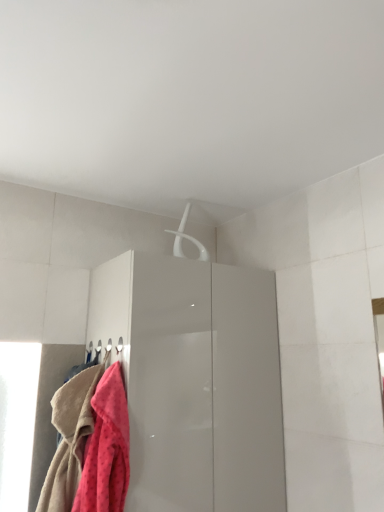
Question: Is fluffy pink towel at lower left, which appears as the 2th towel when viewed from the left, thinner than glossy white cabinet at center?

Choices:
 (A) yes
 (B) no

Answer: (A)

Question: Can you confirm if fluffy pink towel at lower left, which appears as the 2th towel when viewed from the left, is positioned to the right of glossy white cabinet at center?

Choices:
 (A) yes
 (B) no

Answer: (B)

Question: From a real-world perspective, does fluffy pink towel at lower left, which appears as the 2th towel when viewed from the left, stand above glossy white cabinet at center?

Choices:
 (A) yes
 (B) no

Answer: (B)

Question: Can you confirm if fluffy pink towel at lower left, the first towel from the right, is taller than glossy white cabinet at center?

Choices:
 (A) yes
 (B) no

Answer: (B)

Question: Considering the positions of fluffy pink towel at lower left, the first towel from the right, and fluffy pink towel at lower left, arranged as the 1th towel when viewed from the left, in the image, is fluffy pink towel at lower left, the first towel from the right, bigger or smaller than fluffy pink towel at lower left, arranged as the 1th towel when viewed from the left,?

Choices:
 (A) big
 (B) small

Answer: (B)

Question: Which is correct: fluffy pink towel at lower left, the first towel from the right, is inside fluffy pink towel at lower left, arranged as the 1th towel when viewed from the left, or outside of it?

Choices:
 (A) outside
 (B) inside

Answer: (A)

Question: In the image, is fluffy pink towel at lower left, which appears as the 2th towel when viewed from the left, positioned in front of or behind fluffy pink towel at lower left, arranged as the 1th towel when viewed from the left?

Choices:
 (A) front
 (B) behind

Answer: (A)

Question: Is fluffy pink towel at lower left, which appears as the 2th towel when viewed from the left, wider or thinner than fluffy pink towel at lower left, arranged as the 1th towel when viewed from the left?

Choices:
 (A) wide
 (B) thin

Answer: (B)

Question: In terms of width, does glossy white cabinet at center look wider or thinner when compared to fluffy pink towel at lower left, which appears as the 2th towel when viewed from the left?

Choices:
 (A) thin
 (B) wide

Answer: (B)

Question: Is glossy white cabinet at center taller or shorter than fluffy pink towel at lower left, which appears as the 2th towel when viewed from the left?

Choices:
 (A) short
 (B) tall

Answer: (B)

Question: Based on their positions, is glossy white cabinet at center located to the left or right of fluffy pink towel at lower left, which appears as the 2th towel when viewed from the left?

Choices:
 (A) right
 (B) left

Answer: (A)

Question: Do you think glossy white cabinet at center is within fluffy pink towel at lower left, which appears as the 2th towel when viewed from the left, or outside of it?

Choices:
 (A) inside
 (B) outside

Answer: (B)

Question: Relative to fluffy pink towel at lower left, the first towel from the right, is white plastic hanger at upper center in front or behind?

Choices:
 (A) front
 (B) behind

Answer: (B)

Question: In terms of size, does white plastic hanger at upper center appear bigger or smaller than fluffy pink towel at lower left, which appears as the 2th towel when viewed from the left?

Choices:
 (A) big
 (B) small

Answer: (B)